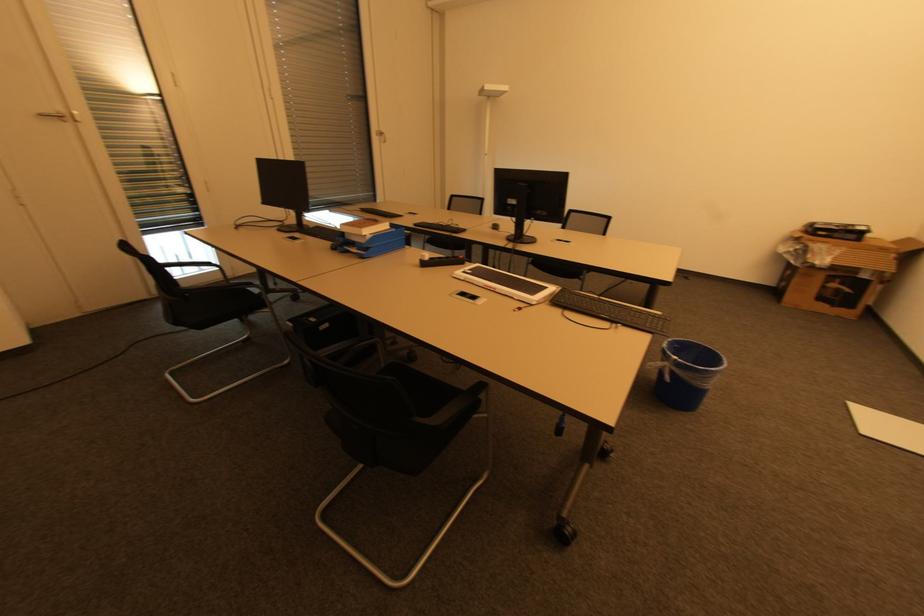
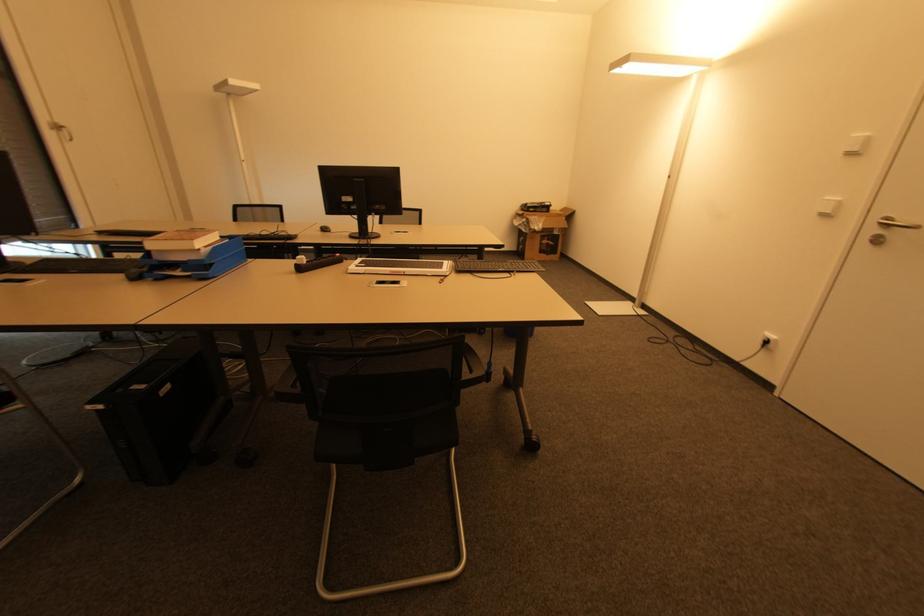
Locate, in the second image, the point that corresponds to the point at 292,326 in the first image.

(101, 408)